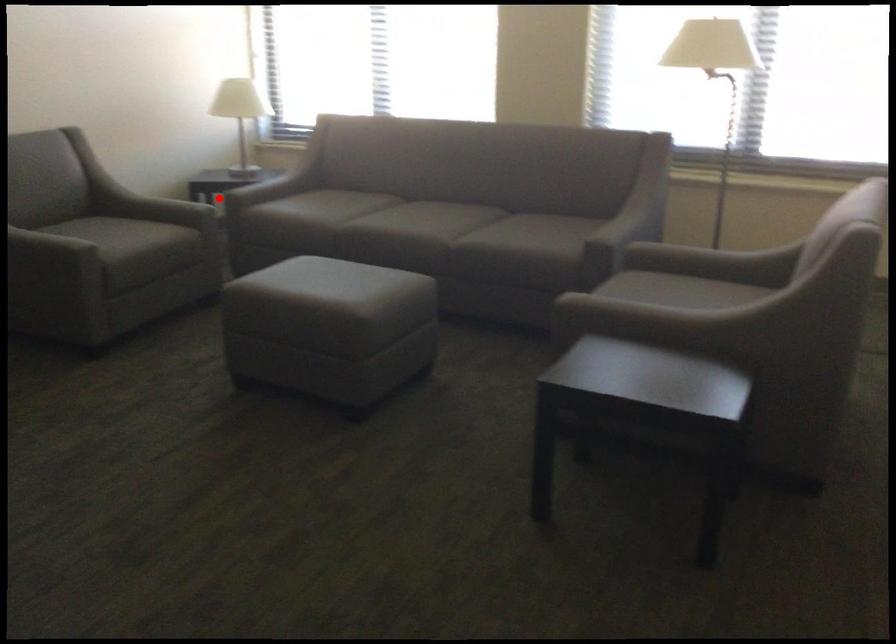
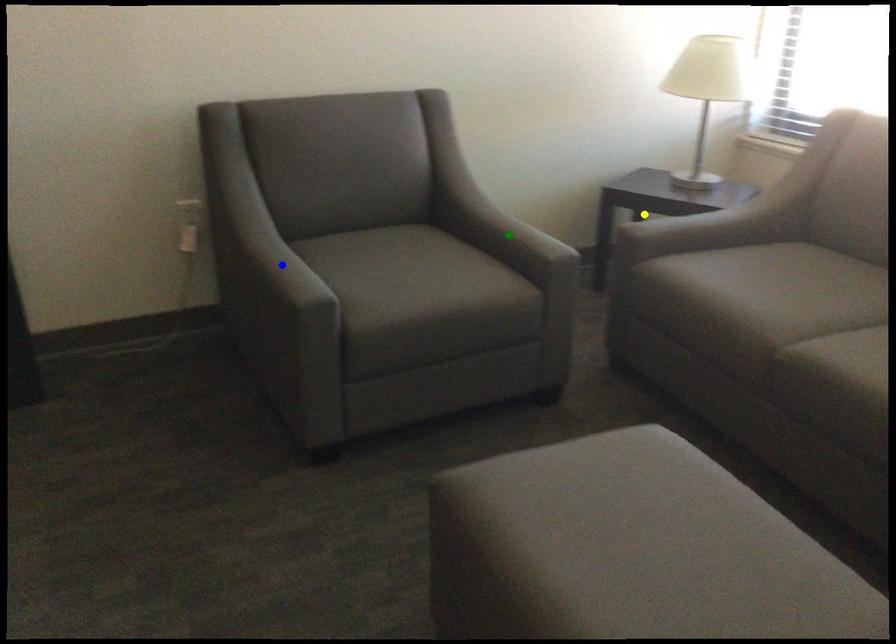
Question: I am providing you with two images of the same scene from different viewpoints. A red point is marked on the first image. You are given multiple points on the second image. Which mark in image 2 goes with the point in image 1?

Choices:
 (A) yellow point
 (B) green point
 (C) blue point

Answer: (A)